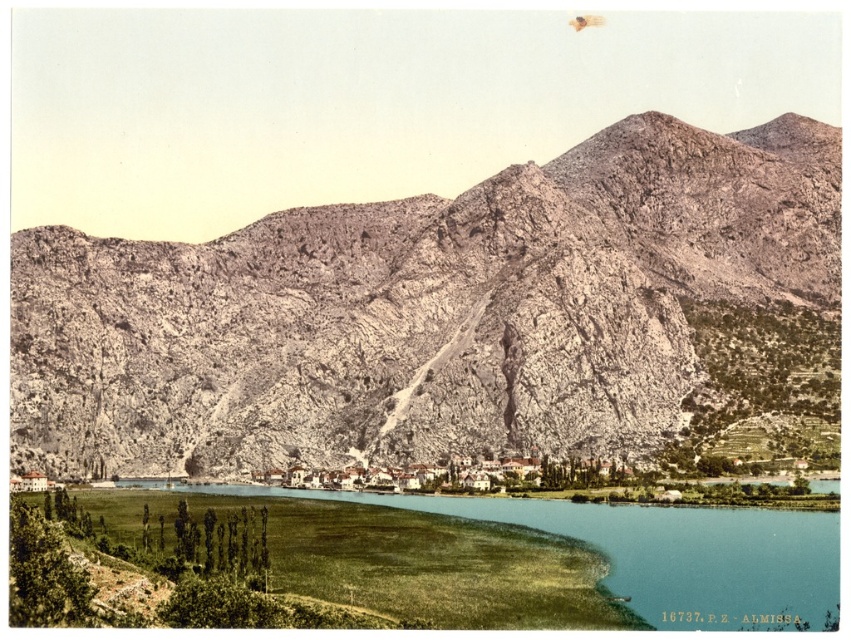
Can you confirm if rugged stone mountain range at center is positioned below green grassy water at lower center?

Incorrect, rugged stone mountain range at center is not positioned below green grassy water at lower center.

Does rugged stone mountain range at center have a smaller size compared to green grassy water at lower center?

Incorrect, rugged stone mountain range at center is not smaller in size than green grassy water at lower center.

Is point (634, 332) behind point (717, 618)?

Yes, it is behind point (717, 618).

Where is `rugged stone mountain range at center`? rugged stone mountain range at center is located at coordinates (423, 308).